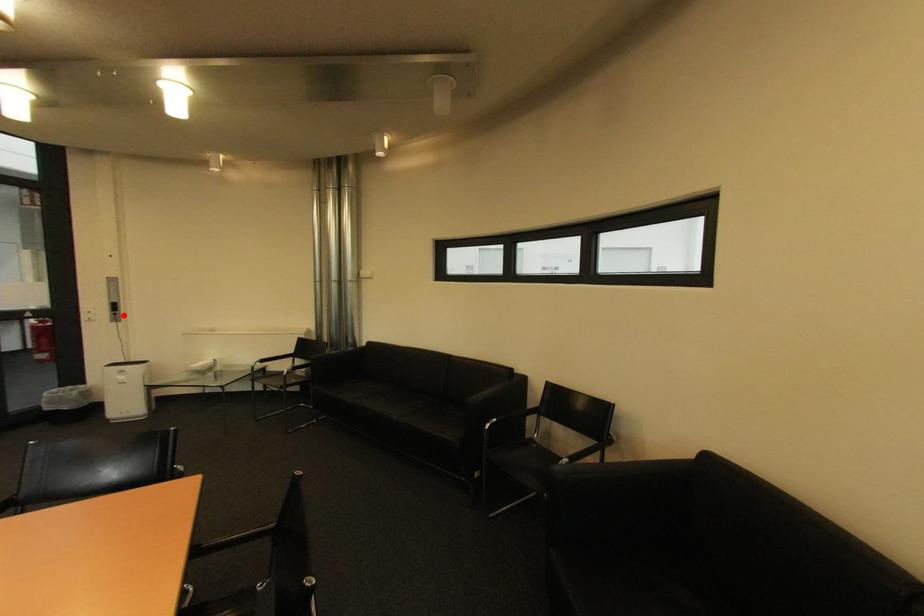
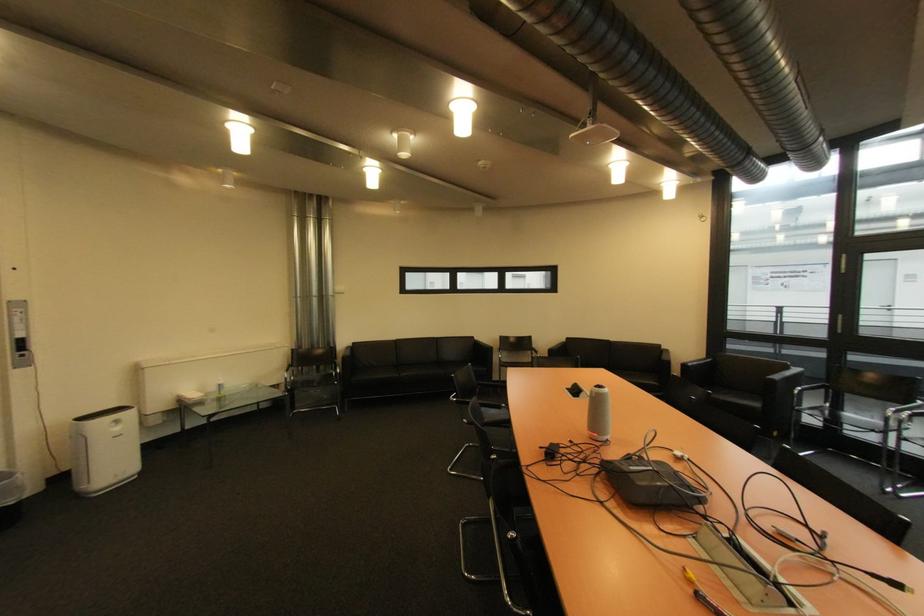
Find the pixel in the second image that matches the highlighted location in the first image.

(30, 357)